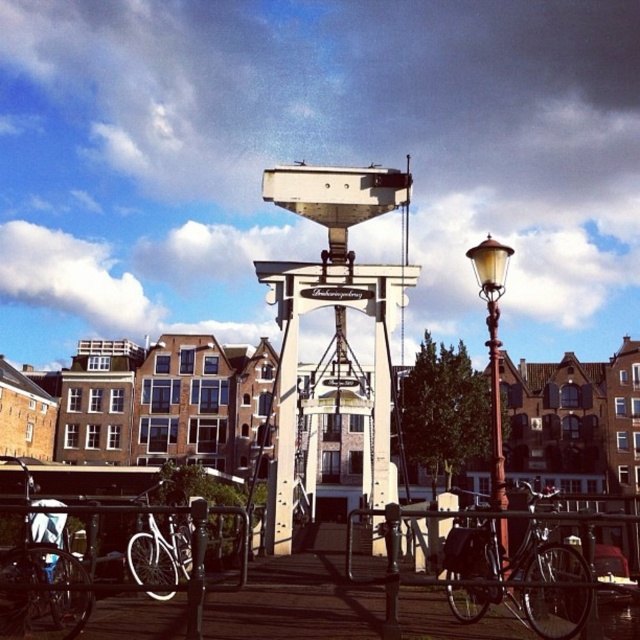
You are standing on the wooden bridge and want to take a photo. You notice two points marked in the scene. Which point, point [67,611] or point [493,392], is closer to your current position?

Point [67,611] is closer to the camera than point [493,392], so it is closer to your current position.

You are standing at the center of the wooden bridge and want to find the white matte bicycle at lower left. According to the coordinates provided, in which direction should you look to locate it?

The white matte bicycle at lower left is located at coordinates point (161, 552), so you should look to the lower left direction from the center of the wooden bridge to locate it.

You are a delivery person standing at the center of the bridge and need to park your bicycle. The silver metallic bicycle at lower left is already parked. Where should you park your bicycle to ensure it is closest to the red lamppost on the right side of the bridge?

Since the silver metallic bicycle at lower left is parked at point (42, 582), you should park your bicycle closer to the right side of the bridge near the red lamppost to be closer to it.